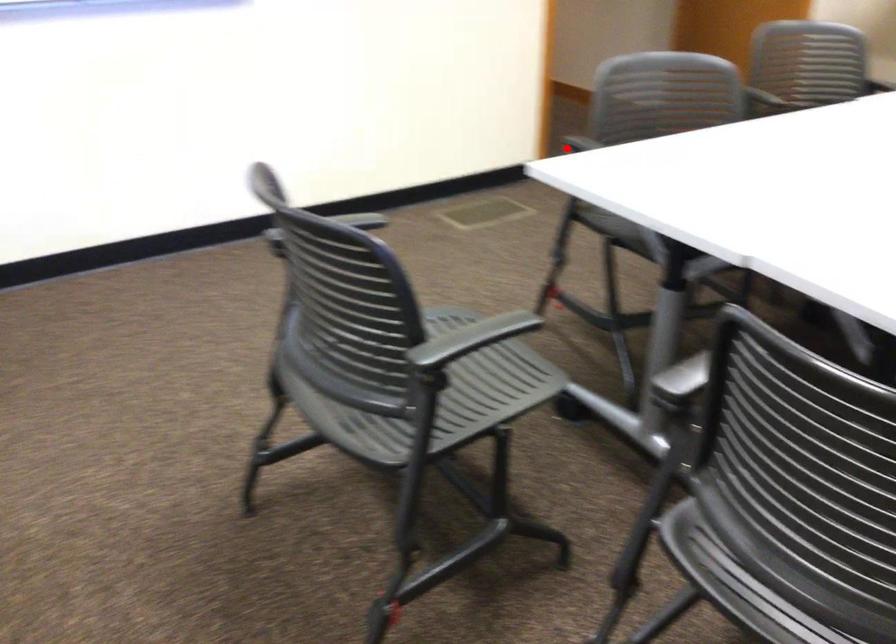
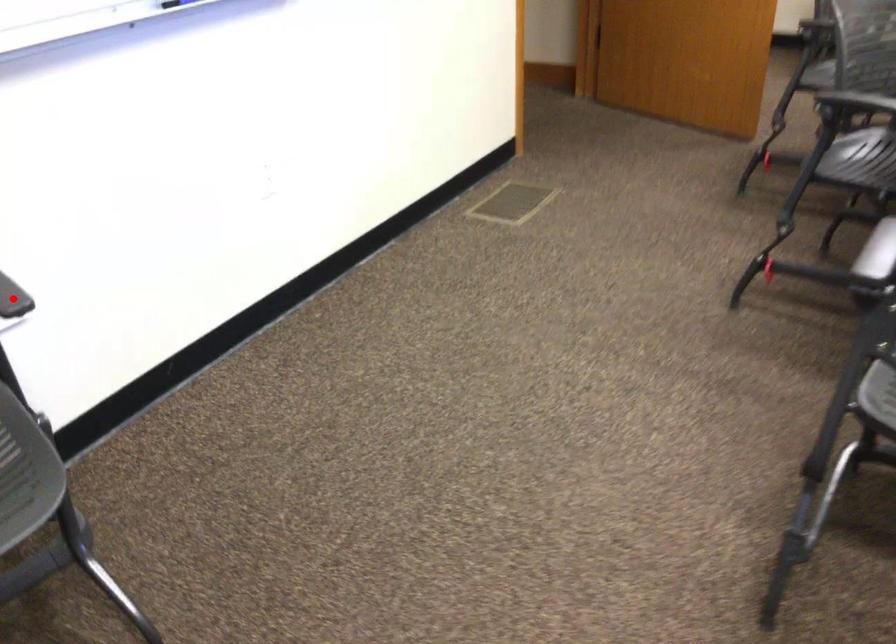
I am providing you with two images of the same scene from different viewpoints. A red point is marked on the first image and another point is marked on the second image. Are the points marked in image1 and image2 representing the same 3D position?

No